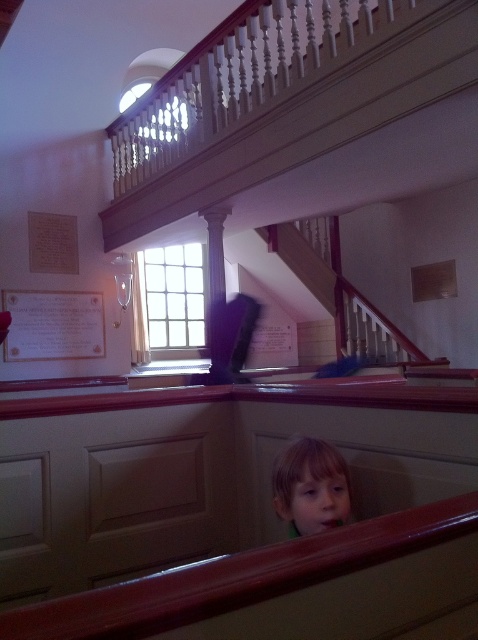
Describe the element at coordinates (339, 291) in the screenshot. This screenshot has height=640, width=478. I see `white wooden staircase at upper center` at that location.

Which is below, white wooden staircase at upper center or white paper at upper left?

Positioned lower is white paper at upper left.

Is point (327, 234) positioned in front of point (49, 326)?

No, (327, 234) is further to viewer.

What are the coordinates of `white wooden staircase at upper center` in the screenshot? It's located at (339, 291).

Does white paper at upper left appear under light brown hair at center?

Incorrect, white paper at upper left is not positioned below light brown hair at center.

Can you confirm if white paper at upper left is wider than light brown hair at center?

Indeed, white paper at upper left has a greater width compared to light brown hair at center.

Measure the distance between white paper at upper left and camera.

The distance of white paper at upper left from camera is 5.33 meters.

The image size is (478, 640). I want to click on white paper at upper left, so click(54, 324).

Does white wooden staircase at upper center appear over light brown hair at center?

→ Indeed, white wooden staircase at upper center is positioned over light brown hair at center.

Which of these two, white wooden staircase at upper center or light brown hair at center, stands taller?

white wooden staircase at upper center

Image resolution: width=478 pixels, height=640 pixels. In order to click on white wooden staircase at upper center in this screenshot , I will do `click(339, 291)`.